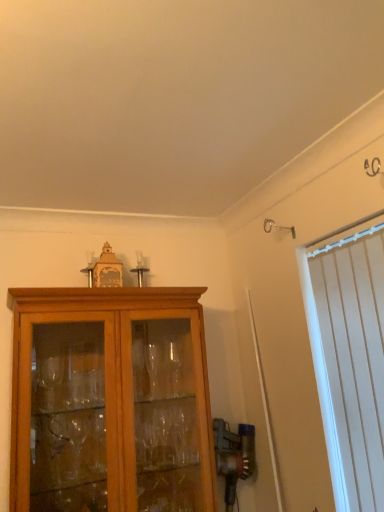
You are a GUI agent. You are given a task and a screenshot of the screen. Output one action in this format:
    pyautogui.click(x=<x>, y=<y>)
    Task: Click on the white vertical blinds at right
    
    Given the screenshot: What is the action you would take?
    pyautogui.click(x=354, y=358)

Describe the element at coordinates (354, 358) in the screenshot. I see `white vertical blinds at right` at that location.

What are the coordinates of `matte wood cabinet at center` in the screenshot? It's located at (112, 389).

Describe the element at coordinates (112, 389) in the screenshot. I see `matte wood cabinet at center` at that location.

The image size is (384, 512). Find the location of `white vertical blinds at right`. white vertical blinds at right is located at coordinates click(354, 358).

Is white vertical blinds at right at the left side of matte wood cabinet at center?

No.

Is white vertical blinds at right in front of or behind matte wood cabinet at center in the image?

white vertical blinds at right is in front of matte wood cabinet at center.

Which is closer to the camera, (368, 445) or (150, 486)?

Positioned in front is point (368, 445).

From the image's perspective, would you say white vertical blinds at right is shown under matte wood cabinet at center?

No, from the image's perspective, white vertical blinds at right is not beneath matte wood cabinet at center.

From a real-world perspective, is white vertical blinds at right positioned above or below matte wood cabinet at center?

In terms of real-world spatial position, white vertical blinds at right is above matte wood cabinet at center.

Is white vertical blinds at right wider than matte wood cabinet at center?

Incorrect, the width of white vertical blinds at right does not surpass that of matte wood cabinet at center.

Considering the relative sizes of white vertical blinds at right and matte wood cabinet at center in the image provided, is white vertical blinds at right taller than matte wood cabinet at center?

Yes, white vertical blinds at right is taller than matte wood cabinet at center.

Considering the relative sizes of white vertical blinds at right and matte wood cabinet at center in the image provided, is white vertical blinds at right smaller than matte wood cabinet at center?

Yes.

Is white vertical blinds at right surrounding matte wood cabinet at center?

No, matte wood cabinet at center is located outside of white vertical blinds at right.

Is white vertical blinds at right not near matte wood cabinet at center?

No, white vertical blinds at right is not far from matte wood cabinet at center.

Is white vertical blinds at right positioned with its back to matte wood cabinet at center?

That's not correct — white vertical blinds at right is not looking away from matte wood cabinet at center.

Can you tell me how much white vertical blinds at right and matte wood cabinet at center differ in facing direction?

The angle between the facing direction of white vertical blinds at right and the facing direction of matte wood cabinet at center is 90.9 degrees.

You are a GUI agent. You are given a task and a screenshot of the screen. Output one action in this format:
    pyautogui.click(x=<x>, y=<y>)
    Task: Click on the curtain located above the matte wood cabinet at center (from the image's perspective)
    The height and width of the screenshot is (512, 384).
    Given the screenshot: What is the action you would take?
    [354, 358]

Does matte wood cabinet at center appear on the left side of white vertical blinds at right?

Correct, you'll find matte wood cabinet at center to the left of white vertical blinds at right.

Which is behind, matte wood cabinet at center or white vertical blinds at right?

matte wood cabinet at center is behind.

Which is behind, point (144, 429) or point (363, 247)?

The point (144, 429) is more distant.

From the image's perspective, which is above, matte wood cabinet at center or white vertical blinds at right?

white vertical blinds at right.

From a real-world perspective, who is located lower, matte wood cabinet at center or white vertical blinds at right?

matte wood cabinet at center.

Which of these two, matte wood cabinet at center or white vertical blinds at right, is thinner?

white vertical blinds at right is thinner.

Between matte wood cabinet at center and white vertical blinds at right, which one has less height?

matte wood cabinet at center.

Considering the sizes of matte wood cabinet at center and white vertical blinds at right in the image, is matte wood cabinet at center bigger or smaller than white vertical blinds at right?

Clearly, matte wood cabinet at center is larger in size than white vertical blinds at right.

Is white vertical blinds at right located within matte wood cabinet at center?

Definitely not — white vertical blinds at right is not inside matte wood cabinet at center.

Is matte wood cabinet at center placed right next to white vertical blinds at right?

No, matte wood cabinet at center is not beside white vertical blinds at right.

Does matte wood cabinet at center turn towards white vertical blinds at right?

No, matte wood cabinet at center does not turn towards white vertical blinds at right.

Locate an element on the screen. This screenshot has height=512, width=384. cabinetry that is under the white vertical blinds at right (from a real-world perspective) is located at coordinates (112, 389).

I want to click on curtain that appears on the right of matte wood cabinet at center, so click(354, 358).

Identify the location of cabinetry below the white vertical blinds at right (from the image's perspective). (112, 389).